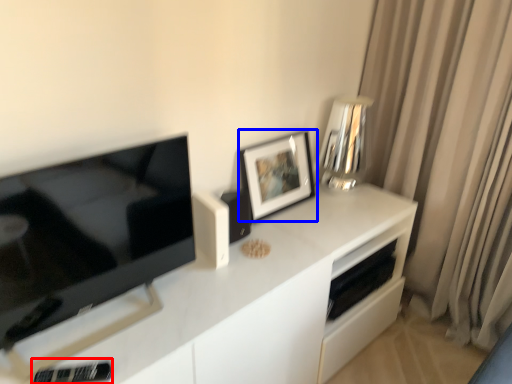
Question: Which point is further to the camera, appliance (highlighted by a red box) or picture frame (highlighted by a blue box)?

Choices:
 (A) appliance
 (B) picture frame

Answer: (B)